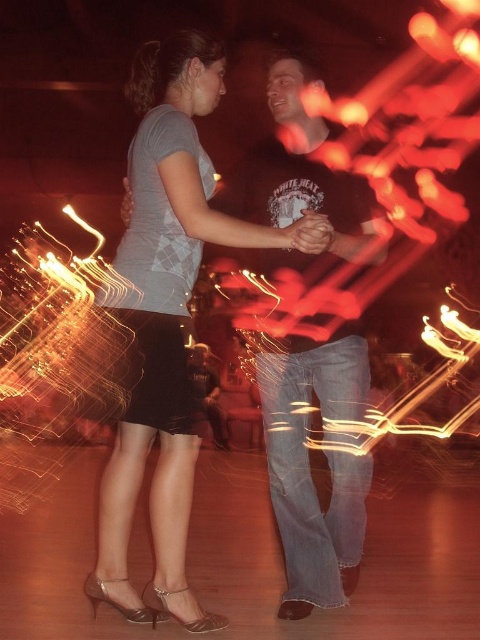
Looking at this image, is matte gray shirt at center smaller than dark brown leather pants at center?

Correct, matte gray shirt at center occupies less space than dark brown leather pants at center.

Is matte gray shirt at center wider than dark brown leather pants at center?

Indeed, matte gray shirt at center has a greater width compared to dark brown leather pants at center.

In the scene shown: Who is more forward, (184, 188) or (316, 209)?

Point (184, 188) is in front.

This screenshot has height=640, width=480. What are the coordinates of `matte gray shirt at center` in the screenshot? It's located at (167, 317).